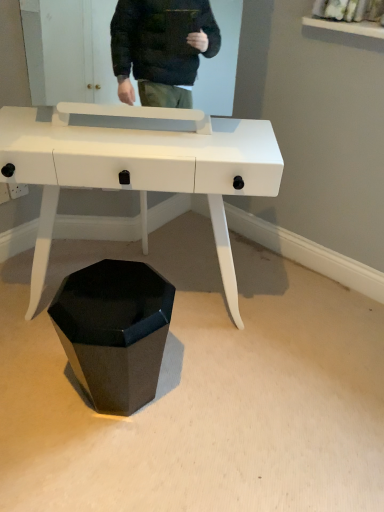
Find the location of a particular element. The width and height of the screenshot is (384, 512). vacant space underneath glossy black hexagonal at lower center (from a real-world perspective) is located at coordinates click(123, 399).